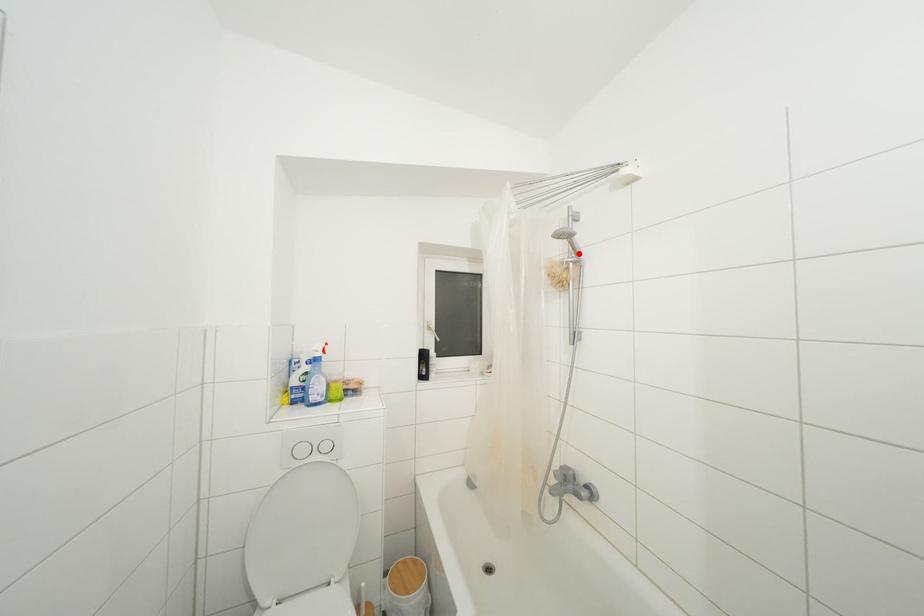
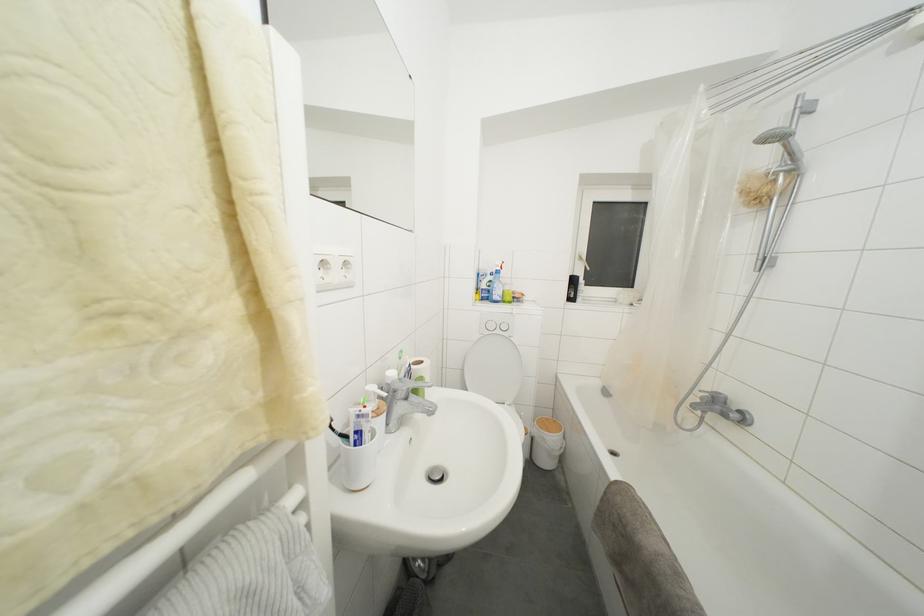
In the second image, find the point that corresponds to the highlighted location in the first image.

(796, 159)